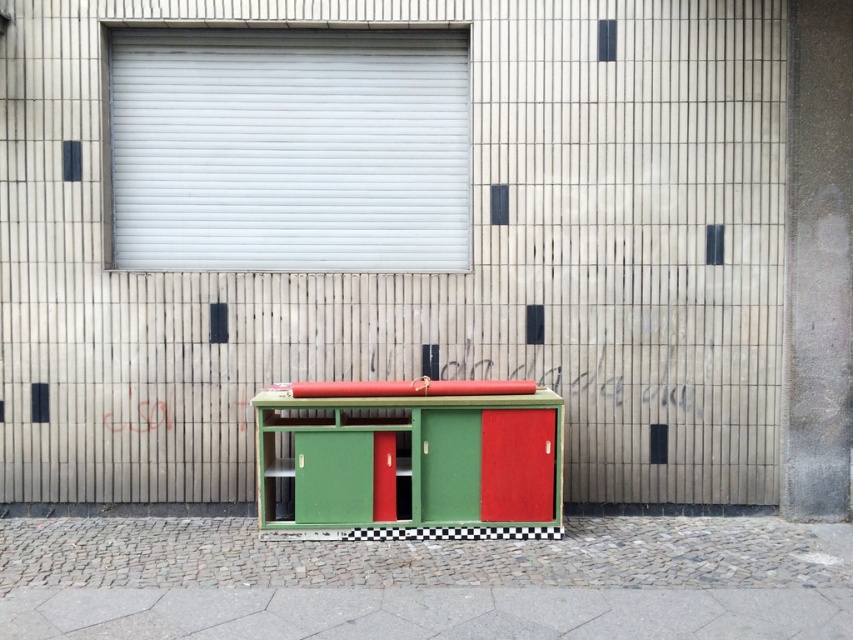
How much distance is there between cobblestone pavement at lower center and green matte cabinet at center?

cobblestone pavement at lower center is 3.52 feet away from green matte cabinet at center.

This screenshot has height=640, width=853. What do you see at coordinates (425, 580) in the screenshot? I see `cobblestone pavement at lower center` at bounding box center [425, 580].

Does point (515, 618) come closer to viewer compared to point (550, 449)?

Yes, point (515, 618) is closer to viewer.

Find the location of a particular element. Image resolution: width=853 pixels, height=640 pixels. cobblestone pavement at lower center is located at coordinates (425, 580).